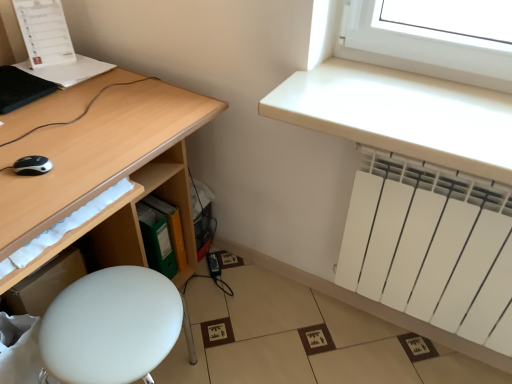
The width and height of the screenshot is (512, 384). I want to click on free location in front of white paper at upper left, so click(x=53, y=72).